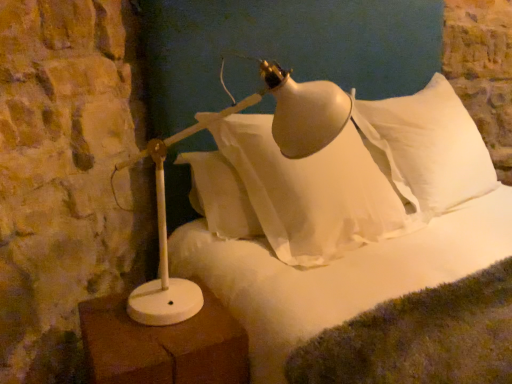
Identify the location of white matte lamp at left. (166, 240).

Considering the relative sizes of white matte table lamp at lower left and white fluffy bed at center in the image provided, is white matte table lamp at lower left wider than white fluffy bed at center?

Incorrect, the width of white matte table lamp at lower left does not surpass that of white fluffy bed at center.

What's the angular difference between white matte table lamp at lower left and white fluffy bed at center's facing directions?

The angle between the facing direction of white matte table lamp at lower left and the facing direction of white fluffy bed at center is 8.9 degrees.

From the image's perspective, is white matte table lamp at lower left beneath white fluffy bed at center?

Correct, white matte table lamp at lower left appears lower than white fluffy bed at center in the image.

From the picture: Does white matte table lamp at lower left have a lesser height compared to white fluffy bed at center?

Yes, white matte table lamp at lower left is shorter than white fluffy bed at center.

Does white matte table lamp at lower left turn towards white soft pillow at upper right?

No, white matte table lamp at lower left is not turned towards white soft pillow at upper right.

This screenshot has height=384, width=512. Identify the location of pillow that is on the right side of white matte table lamp at lower left. (426, 147).

Is white matte table lamp at lower left at the left side of white soft pillow at upper right?

Correct, you'll find white matte table lamp at lower left to the left of white soft pillow at upper right.

Which is behind, white matte table lamp at lower left or white soft pillow at upper right?

white soft pillow at upper right is more distant.

Is white matte lamp at left turned away from white fluffy bed at center?

No.

Is white matte lamp at left to the left or to the right of white fluffy bed at center in the image?

white matte lamp at left is positioned on white fluffy bed at center's left side.

Would you say white matte lamp at left is a long distance from white fluffy bed at center?

white matte lamp at left is actually quite close to white fluffy bed at center.

Consider the image. How distant is white matte lamp at left from white fluffy bed at center?

They are 54.28 centimeters apart.

From the image's perspective, is white fluffy bed at center positioned above or below white soft pillow at upper right?

Based on their image positions, white fluffy bed at center is located beneath white soft pillow at upper right.

From a real-world perspective, is white fluffy bed at center located beneath white soft pillow at upper right?

Incorrect, from a real-world perspective, white fluffy bed at center is higher than white soft pillow at upper right.

Is white fluffy bed at center bigger or smaller than white soft pillow at upper right?

In the image, white fluffy bed at center appears to be larger than white soft pillow at upper right.

Based on the photo, considering the relative sizes of white fluffy bed at center and white soft pillow at upper right in the image provided, is white fluffy bed at center thinner than white soft pillow at upper right?

Incorrect, the width of white fluffy bed at center is not less than that of white soft pillow at upper right.

Is white matte lamp at left beside white soft pillow at upper right?

white matte lamp at left and white soft pillow at upper right are clearly separated.

From the image's perspective, which one is positioned lower, white matte lamp at left or white soft pillow at upper right?

white matte lamp at left, from the image's perspective.

This screenshot has height=384, width=512. What are the coordinates of `pillow lying behind the white matte lamp at left` in the screenshot? It's located at (426, 147).

Is white matte lamp at left shorter than white soft pillow at upper right?

Yes, white matte lamp at left is shorter than white soft pillow at upper right.

Considering the relative sizes of white soft pillow at upper right and white fluffy bed at center in the image provided, is white soft pillow at upper right bigger than white fluffy bed at center?

No.

Between white soft pillow at upper right and white fluffy bed at center, which one is positioned in front?

Positioned in front is white fluffy bed at center.

Is white soft pillow at upper right not inside white fluffy bed at center?

Yes, white soft pillow at upper right is not within white fluffy bed at center.

Does white soft pillow at upper right appear on the left side of white matte lamp at left?

Incorrect, white soft pillow at upper right is not on the left side of white matte lamp at left.

Which of these two, white soft pillow at upper right or white matte lamp at left, is bigger?

white soft pillow at upper right.

What's the angular difference between white soft pillow at upper right and white matte lamp at left's facing directions?

The angular difference between white soft pillow at upper right and white matte lamp at left is 47.5 degrees.

Find the location of `pillow above the white matte lamp at left (from the image's perspective)`. pillow above the white matte lamp at left (from the image's perspective) is located at coordinates (426, 147).

This screenshot has height=384, width=512. I want to click on bed above the white matte table lamp at lower left (from a real-world perspective), so click(342, 218).

Image resolution: width=512 pixels, height=384 pixels. Identify the location of furniture that appears in front of the white soft pillow at upper right. (163, 345).

Estimate the real-world distances between objects in this image. Which object is closer to white matte table lamp at lower left, white soft pillow at upper right or white fluffy bed at center?

white fluffy bed at center is positioned closer to the anchor white matte table lamp at lower left.

When comparing their distances from white fluffy bed at center, does white matte lamp at left or white soft pillow at upper right seem closer?

white soft pillow at upper right.

Looking at the image, which one is located further to white matte table lamp at lower left, white matte lamp at left or white fluffy bed at center?

The object further to white matte table lamp at lower left is white fluffy bed at center.

Which object lies nearer to the anchor point white matte lamp at left, white soft pillow at upper right or white fluffy bed at center?

white fluffy bed at center is closer to white matte lamp at left.

From the image, which object appears to be nearer to white soft pillow at upper right, white fluffy bed at center or white matte table lamp at lower left?

white fluffy bed at center.

Which object lies nearer to the anchor point white matte lamp at left, white matte table lamp at lower left or white soft pillow at upper right?

white matte table lamp at lower left is closer to white matte lamp at left.

When comparing their distances from white fluffy bed at center, does white matte lamp at left or white matte table lamp at lower left seem further?

white matte lamp at left.

Estimate the real-world distances between objects in this image. Which object is closer to white fluffy bed at center, white soft pillow at upper right or white matte table lamp at lower left?

white soft pillow at upper right is positioned closer to the anchor white fluffy bed at center.

This screenshot has height=384, width=512. In order to click on lamp between white matte table lamp at lower left and white soft pillow at upper right in the horizontal direction in this screenshot , I will do `click(166, 240)`.

Locate an element on the screen. bed between white matte table lamp at lower left and white soft pillow at upper right from left to right is located at coordinates (342, 218).

Identify the location of bed located between white matte lamp at left and white soft pillow at upper right in the left-right direction. (342, 218).

Where is `lamp between white fluffy bed at center and white matte table lamp at lower left from top to bottom`? The image size is (512, 384). lamp between white fluffy bed at center and white matte table lamp at lower left from top to bottom is located at coordinates (166, 240).